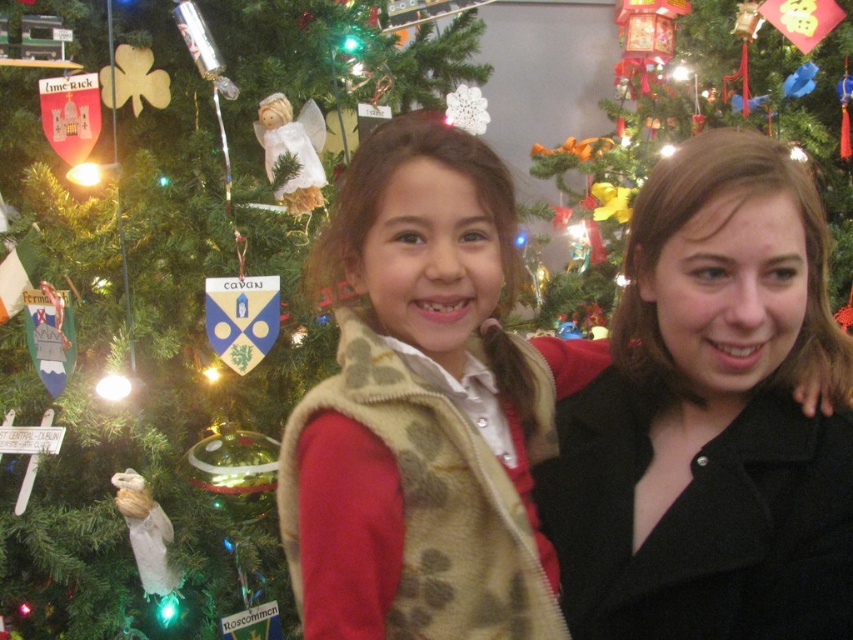
Question: Which point is closer to the camera taking this photo?

Choices:
 (A) (184, 388)
 (B) (448, 614)
 (C) (775, 618)

Answer: (C)

Question: Can you confirm if black matte coat at center is smaller than shiny metallic ornaments at upper right?

Choices:
 (A) no
 (B) yes

Answer: (B)

Question: Is black matte coat at center wider than shiny metallic ornaments at upper right?

Choices:
 (A) no
 (B) yes

Answer: (A)

Question: Which point appears closest to the camera in this image?

Choices:
 (A) (514, 273)
 (B) (850, 577)

Answer: (B)

Question: Is black matte coat at center bigger than green matte christmas tree at left?

Choices:
 (A) yes
 (B) no

Answer: (B)

Question: Which point is farther to the camera?

Choices:
 (A) green matte christmas tree at left
 (B) shiny metallic ornaments at upper right
 (C) black matte coat at center

Answer: (B)